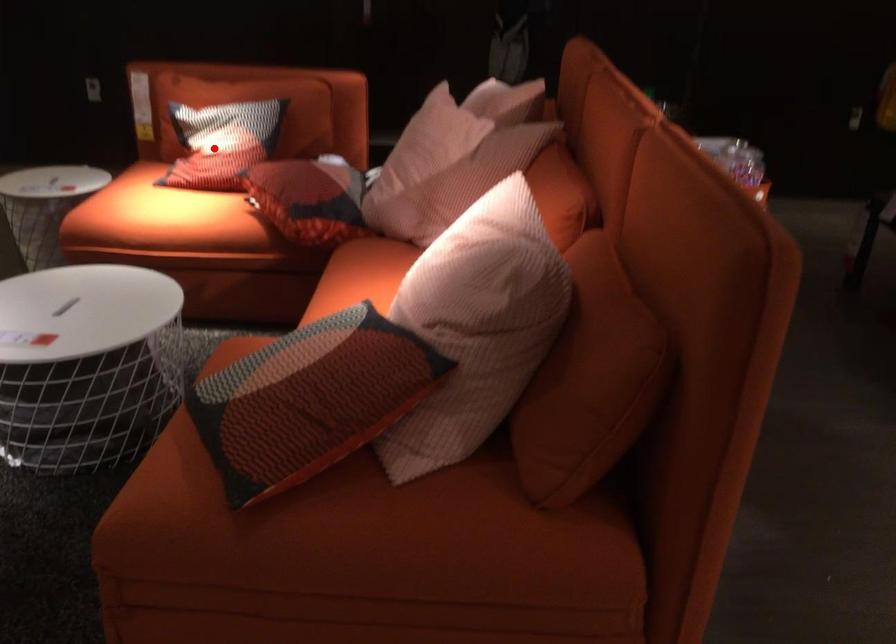
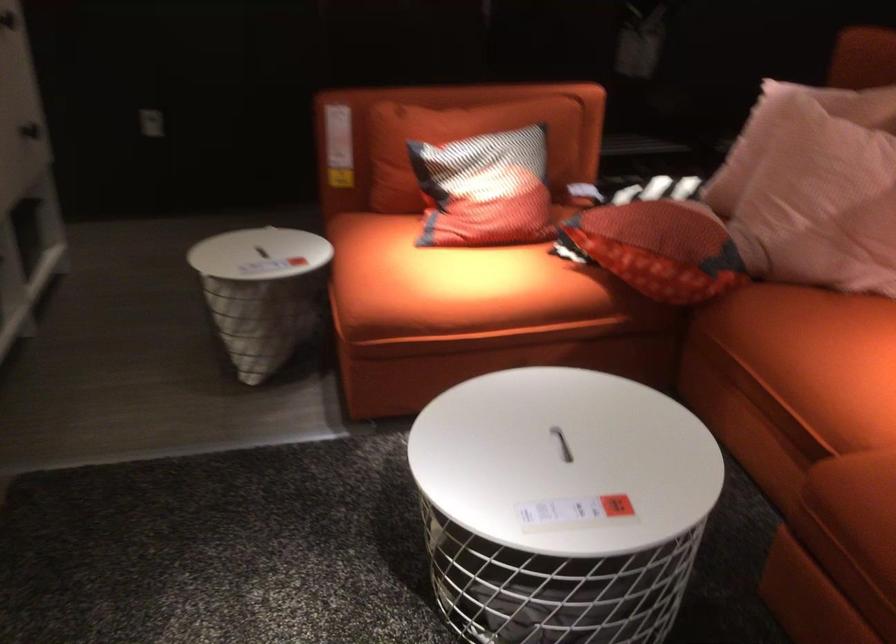
Question: A red point is marked in image1. In image2, is the corresponding 3D point closer to the camera or farther? Reply with the corresponding letter.

Choices:
 (A) The corresponding 3D point is closer.
 (B) The corresponding 3D point is farther.

Answer: (A)